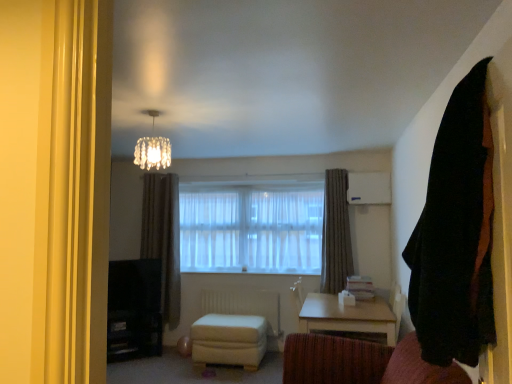
Identify the location of vacant area situated below white sheer curtains at center (from a real-world perspective). This screenshot has height=384, width=512. (261, 268).